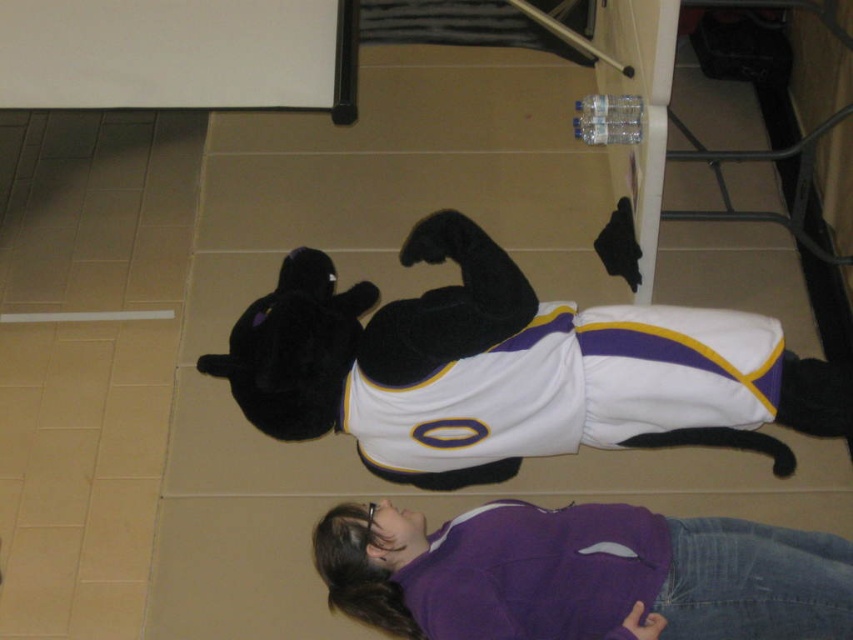
Is the position of black plush toy at center less distant than that of purple fleece jacket at lower center?

That is False.

Is black plush toy at center above purple fleece jacket at lower center?

Yes, black plush toy at center is above purple fleece jacket at lower center.

Is point (407, 445) more distant than point (665, 586)?

Yes, point (407, 445) is behind point (665, 586).

Find the location of `black plush toy at center`. black plush toy at center is located at coordinates (509, 369).